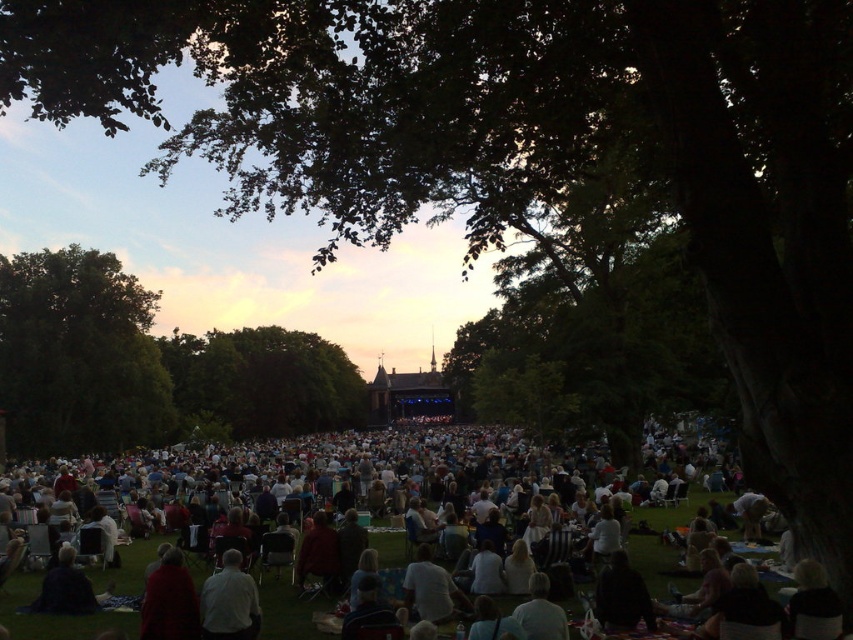
Question: Which of the following is the closest to the observer?

Choices:
 (A) white fabric shirt at lower center
 (B) light beige fabric blanket at center
 (C) green leafy tree at center
 (D) green leafy tree at left

Answer: (B)

Question: Is green leafy tree at center bigger than white fabric shirt at lower center?

Choices:
 (A) yes
 (B) no

Answer: (A)

Question: Which is farther from the light beige fabric blanket at center?

Choices:
 (A) green leafy tree at center
 (B) white fabric shirt at lower center
 (C) green leafy tree at left

Answer: (B)

Question: Can you confirm if light beige fabric blanket at center is smaller than green leafy tree at left?

Choices:
 (A) yes
 (B) no

Answer: (B)

Question: Which of these objects is positioned farthest from the green leafy tree at center?

Choices:
 (A) green leafy tree at left
 (B) white fabric shirt at lower center

Answer: (B)

Question: Observing the image, what is the correct spatial positioning of light beige fabric blanket at center in reference to green leafy tree at center?

Choices:
 (A) right
 (B) left

Answer: (A)